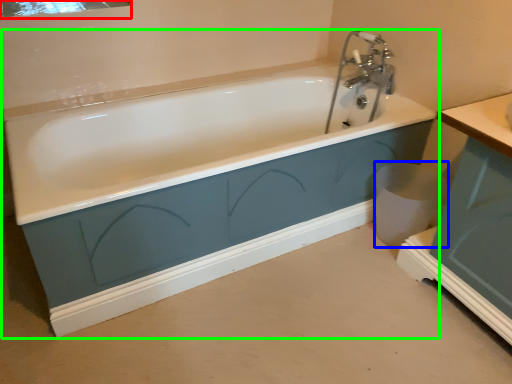
Question: Which is nearer to the mirror (highlighted by a red box)? toilet bowl (highlighted by a blue box) or bathtub (highlighted by a green box).

Choices:
 (A) toilet bowl
 (B) bathtub

Answer: (B)